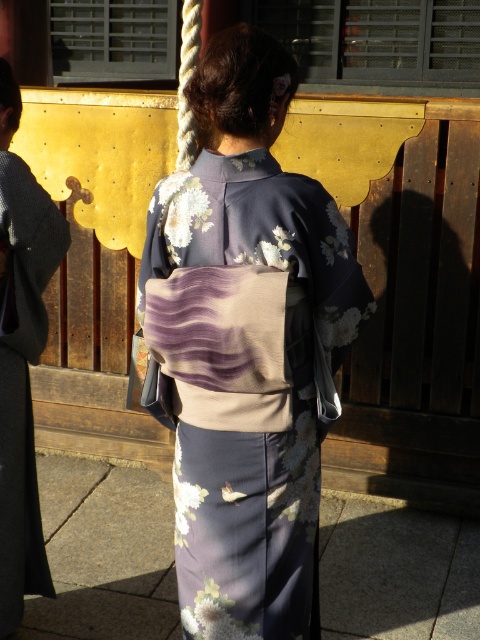
You are a photographer trying to capture the person in the floral kimono at center and the silky black kimono at center. Which kimono should you focus on first to ensure it appears larger in the photo?

The floral kimono at center is closer to the viewer than the silky black kimono at center, so focusing on it first will make it appear larger in the photo.

You are a photographer positioned at the center of the scene. You want to capture the floral kimono at center in your shot. Which direction should you aim your camera to ensure the kimono is in the frame?

The floral kimono at center is already positioned at the center of the scene, so aiming the camera towards the center will ensure it is in the frame.